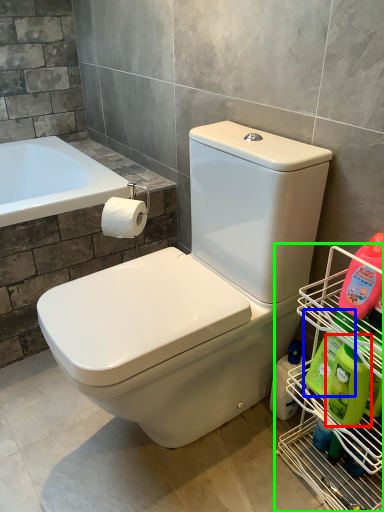
Question: Which is nearer to the cleaning product (highlighted by a red box)? cleaning product (highlighted by a blue box) or shelf (highlighted by a green box).

Choices:
 (A) cleaning product
 (B) shelf

Answer: (A)